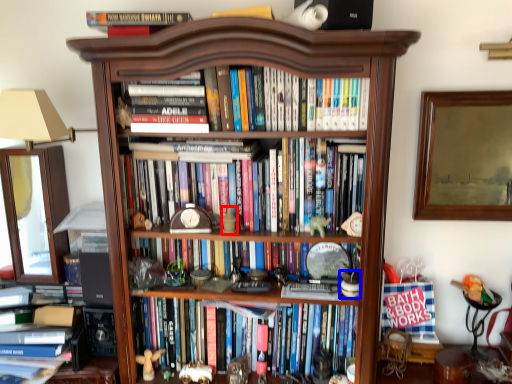
Question: Which object appears farthest to the camera in this image, toy (highlighted by a red box) or toy (highlighted by a blue box)?

Choices:
 (A) toy
 (B) toy

Answer: (A)